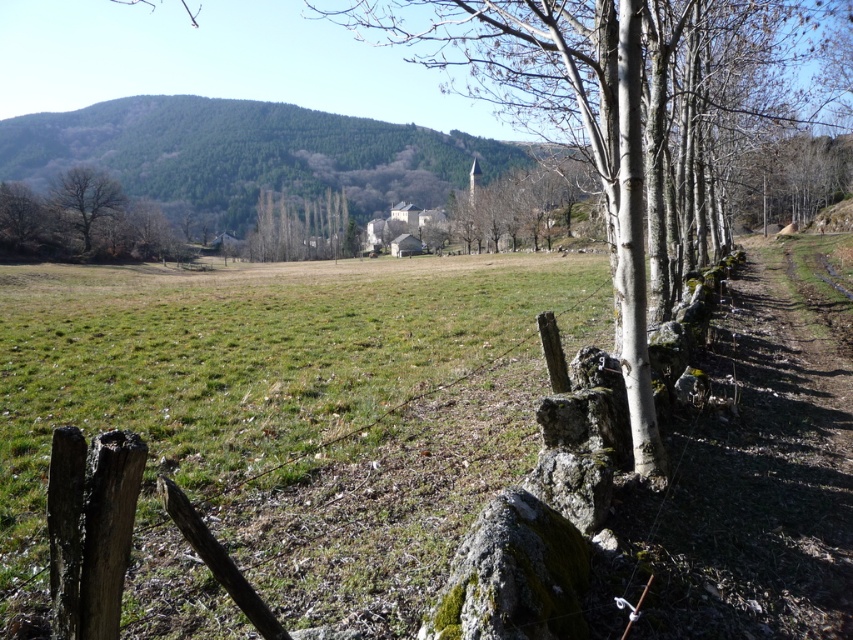
Question: Can you confirm if weathered wood fence at lower left is bigger than brown rough tree at left?

Choices:
 (A) no
 (B) yes

Answer: (A)

Question: Does weathered wood fence at lower left have a smaller size compared to brown rough tree at left?

Choices:
 (A) no
 (B) yes

Answer: (B)

Question: Among these points, which one is nearest to the camera?

Choices:
 (A) (115, 193)
 (B) (94, 465)

Answer: (B)

Question: Does weathered wood fence at lower left appear over brown rough tree at left?

Choices:
 (A) yes
 (B) no

Answer: (B)